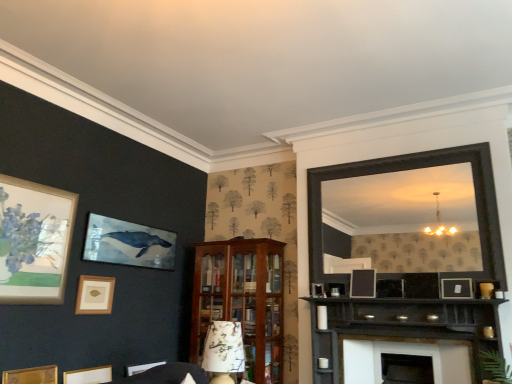
The width and height of the screenshot is (512, 384). In order to click on free space above black wooden mirror at upper right (from a real-world perspective) in this screenshot , I will do `click(389, 157)`.